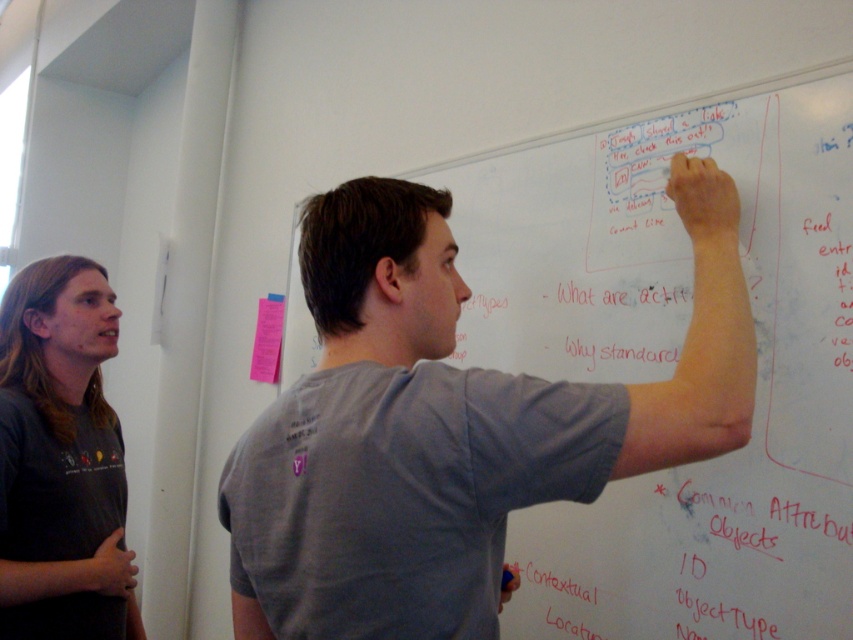
Who is more distant from viewer, (105, 512) or (264, 346)?

The point (264, 346) is more distant.

Who is lower down, black t-shirt at left or pink paper at left?

black t-shirt at left

Locate an element on the screen. The height and width of the screenshot is (640, 853). black t-shirt at left is located at coordinates (61, 452).

Does gray matte shirt at upper center appear under black t-shirt at left?

Incorrect, gray matte shirt at upper center is not positioned below black t-shirt at left.

Find the location of a particular element. This screenshot has height=640, width=853. gray matte shirt at upper center is located at coordinates (450, 424).

This screenshot has height=640, width=853. What are the coordinates of `gray matte shirt at upper center` in the screenshot? It's located at [x=450, y=424].

At what (x,y) coordinates should I click in order to perform the action: click on gray matte shirt at upper center. Please return your answer as a coordinate pair (x, y). The width and height of the screenshot is (853, 640). Looking at the image, I should click on (450, 424).

Is gray matte shirt at upper center smaller than pink paper at left?

Actually, gray matte shirt at upper center might be larger than pink paper at left.

Between point (280, 410) and point (280, 307), which one is positioned in front?

Point (280, 410)

Find the location of a particular element. The image size is (853, 640). gray matte shirt at upper center is located at coordinates (450, 424).